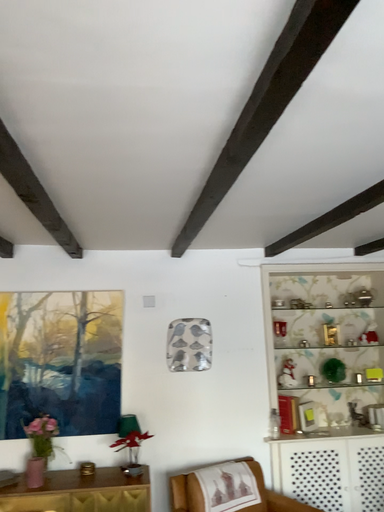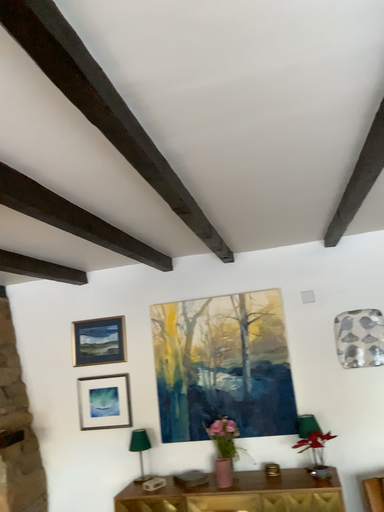
Question: Which way did the camera rotate in the video?

Choices:
 (A) rotated right
 (B) rotated left

Answer: (B)